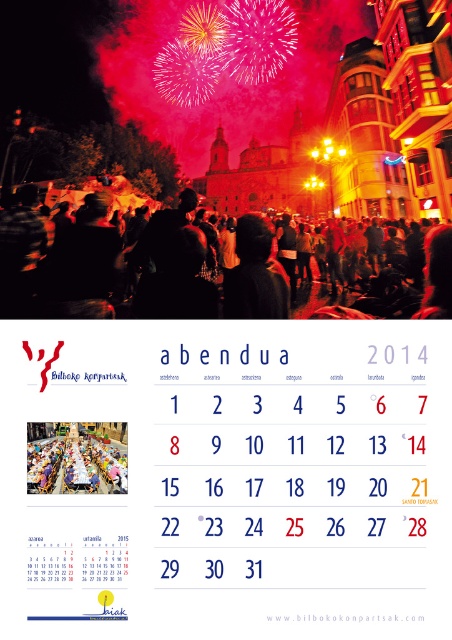
Is white paper calendar at center to the left of white paper website at center from the viewer's perspective?

Yes, white paper calendar at center is to the left of white paper website at center.

Is white paper calendar at center closer to the viewer compared to white paper website at center?

Yes, white paper calendar at center is in front of white paper website at center.

Where is `white paper calendar at center`? This screenshot has height=640, width=452. white paper calendar at center is located at coordinates (230, 477).

Is white paper calendar at center to the right of matte plastic table at center from the viewer's perspective?

Correct, you'll find white paper calendar at center to the right of matte plastic table at center.

Locate an element on the screen. This screenshot has height=640, width=452. white paper calendar at center is located at coordinates (230, 477).

Where is `white paper calendar at center`? This screenshot has width=452, height=640. white paper calendar at center is located at coordinates (230, 477).

Can you confirm if white paper calendar at center is wider than dark hair at center?

In fact, white paper calendar at center might be narrower than dark hair at center.

Image resolution: width=452 pixels, height=640 pixels. Find the location of `white paper calendar at center`. white paper calendar at center is located at coordinates (230, 477).

Locate an element on the screen. The width and height of the screenshot is (452, 640). white paper calendar at center is located at coordinates click(x=230, y=477).